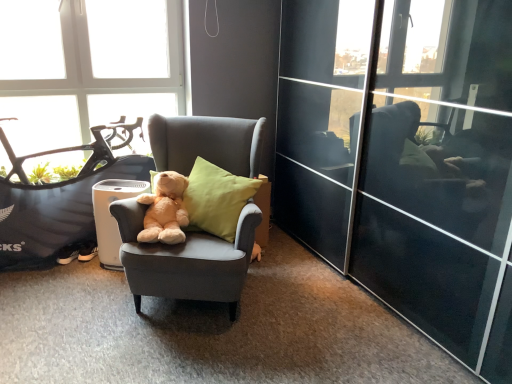
At what (x,y) coordinates should I click in order to perform the action: click on free area in between matte gray armchair at center and black matte mountain bike at left. Please return your answer as a coordinate pair (x, y). The height and width of the screenshot is (384, 512). Looking at the image, I should click on (74, 288).